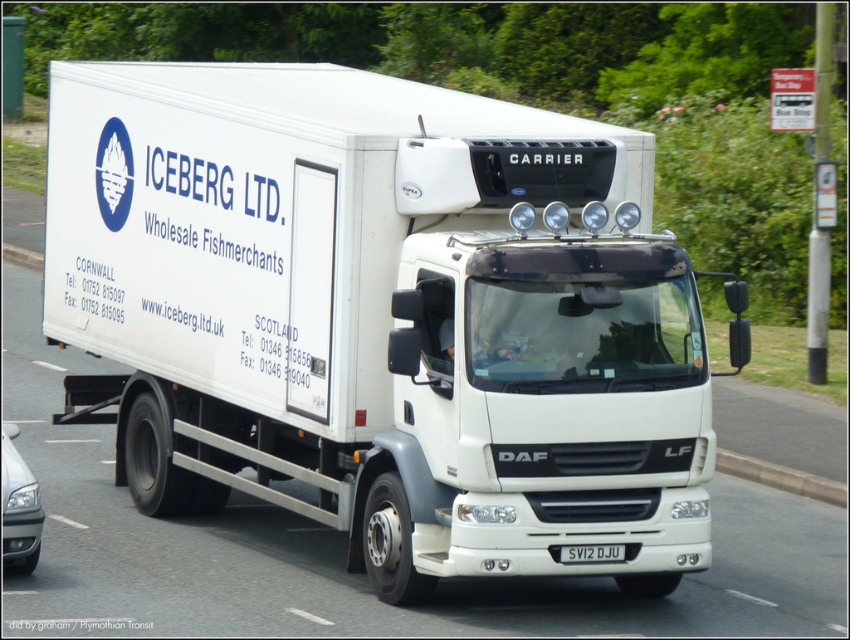
Question: Which point is farther to the camera?

Choices:
 (A) white matte truck at center
 (B) black plastic license plate at center
 (C) matte silver headlight at lower left

Answer: (C)

Question: Is matte silver headlight at lower left smaller than black plastic license plate at center?

Choices:
 (A) yes
 (B) no

Answer: (B)

Question: Does white matte truck at center have a larger size compared to black plastic license plate at center?

Choices:
 (A) no
 (B) yes

Answer: (B)

Question: Estimate the real-world distances between objects in this image. Which object is closer to the white matte truck at center?

Choices:
 (A) matte silver headlight at lower left
 (B) black plastic license plate at center

Answer: (B)

Question: Which point is farther from the camera taking this photo?

Choices:
 (A) (242, 163)
 (B) (15, 476)

Answer: (A)

Question: Can you confirm if white matte truck at center is positioned above black plastic license plate at center?

Choices:
 (A) no
 (B) yes

Answer: (B)